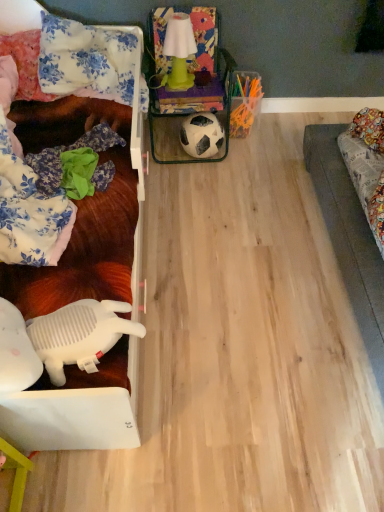
Question: Relative to floral fabric pillow at upper left, the 2th pillow from the left, is floral fabric pillow at upper left, marked as the second pillow in a right-to-left arrangement, in front or behind?

Choices:
 (A) behind
 (B) front

Answer: (A)

Question: Is floral fabric pillow at upper left, positioned as the first pillow in left-to-right order, inside or outside of floral fabric pillow at upper left, acting as the first pillow starting from the right?

Choices:
 (A) inside
 (B) outside

Answer: (B)

Question: Which of these objects is positioned farthest from the white plastic toy at lower left?

Choices:
 (A) floral fabric pillow at upper left, marked as the second pillow in a right-to-left arrangement
 (B) white plastic toy at left
 (C) green matte lamp at upper center
 (D) floral fabric pillow at upper left, the 2th pillow from the left
 (E) white matte football at center

Answer: (C)

Question: Which of these objects is positioned farthest from the floral fabric pillow at upper left, positioned as the first pillow in left-to-right order?

Choices:
 (A) white plastic toy at left
 (B) white matte football at center
 (C) floral fabric pillow at upper left, the 2th pillow from the left
 (D) green matte lamp at upper center
 (E) white plastic toy at lower left

Answer: (E)